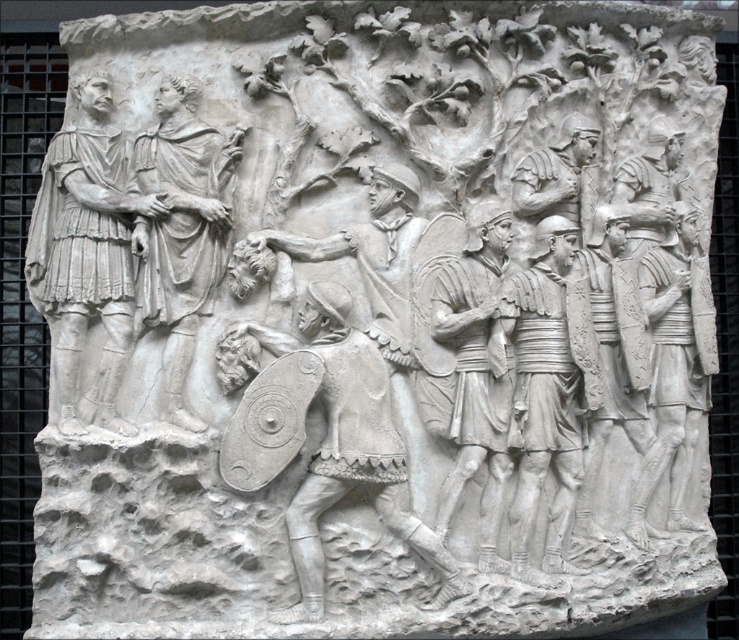
Question: Is white stone soldier at left closer to the viewer compared to white stone figure at left?

Choices:
 (A) yes
 (B) no

Answer: (A)

Question: Which of these objects is positioned closest to the white stone helmet at right?

Choices:
 (A) white stone warrior at center
 (B) white stone figure at left
 (C) white stone shield at center

Answer: (A)

Question: Does white stone soldiers at center have a smaller size compared to white stone helmet at right?

Choices:
 (A) no
 (B) yes

Answer: (B)

Question: From the image, what is the correct spatial relationship of white stone soldier at left in relation to white stone helmet at right?

Choices:
 (A) below
 (B) above

Answer: (B)

Question: Among these points, which one is farthest from the camera?

Choices:
 (A) (327, 403)
 (B) (50, 209)

Answer: (B)

Question: Estimate the real-world distances between objects in this image. Which object is farther from the white stone soldier at left?

Choices:
 (A) white stone figure at left
 (B) white stone warrior at center
 (C) white stone soldiers at center

Answer: (C)